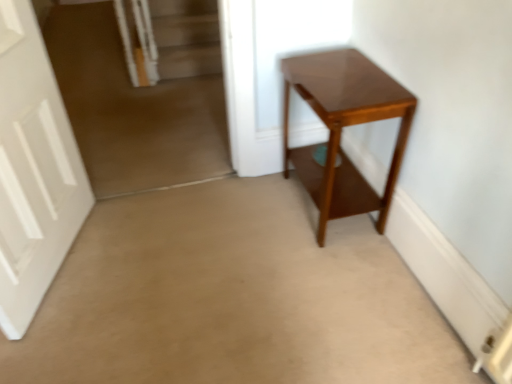
What are the coordinates of `glossy wood table at center` in the screenshot? It's located at (342, 127).

Image resolution: width=512 pixels, height=384 pixels. What do you see at coordinates (342, 127) in the screenshot?
I see `glossy wood table at center` at bounding box center [342, 127].

Describe the element at coordinates (33, 170) in the screenshot. The image size is (512, 384). I see `white matte door at left` at that location.

The image size is (512, 384). Find the location of `white matte door at left`. white matte door at left is located at coordinates (33, 170).

At what (x,y) coordinates should I click in order to perform the action: click on glossy wood table at center. Please return your answer as a coordinate pair (x, y). Looking at the image, I should click on (342, 127).

In the scene shown: Considering the positions of objects glossy wood table at center and white matte door at left in the image provided, who is more to the right, glossy wood table at center or white matte door at left?

Positioned to the right is glossy wood table at center.

Which is behind, glossy wood table at center or white matte door at left?

glossy wood table at center is further from the camera.

Between point (341, 62) and point (32, 107), which one is positioned behind?

Positioned behind is point (341, 62).

From the image's perspective, which one is positioned higher, glossy wood table at center or white matte door at left?

glossy wood table at center, from the image's perspective.

From a real-world perspective, between glossy wood table at center and white matte door at left, who is vertically lower?

glossy wood table at center.

Considering the sizes of objects glossy wood table at center and white matte door at left in the image provided, who is wider, glossy wood table at center or white matte door at left?

glossy wood table at center is wider.

Can you confirm if glossy wood table at center is shorter than white matte door at left?

Yes, glossy wood table at center is shorter than white matte door at left.

Is glossy wood table at center smaller than white matte door at left?

Actually, glossy wood table at center might be larger than white matte door at left.

Do you think glossy wood table at center is within white matte door at left, or outside of it?

glossy wood table at center is outside white matte door at left.

Would you say glossy wood table at center is a long distance from white matte door at left?

Indeed, glossy wood table at center is not near white matte door at left.

Could you tell me if glossy wood table at center is facing white matte door at left?

Yes, glossy wood table at center is facing white matte door at left.

How different are the orientations of glossy wood table at center and white matte door at left in degrees?

161 degrees separate the facing orientations of glossy wood table at center and white matte door at left.

How distant is glossy wood table at center from white matte door at left?

→ They are 1.16 meters apart.

At what (x,y) coordinates should I click in order to perform the action: click on door that appears in front of the glossy wood table at center. Please return your answer as a coordinate pair (x, y). Looking at the image, I should click on (33, 170).

Which object is positioned more to the left, white matte door at left or glossy wood table at center?

Positioned to the left is white matte door at left.

Relative to glossy wood table at center, is white matte door at left in front or behind?

white matte door at left is in front of glossy wood table at center.

Looking at this image, which is less distant, (73, 161) or (333, 196)?

Point (73, 161) is positioned farther from the camera compared to point (333, 196).

From the image's perspective, which is above, white matte door at left or glossy wood table at center?

glossy wood table at center, from the image's perspective.

From a real-world perspective, between white matte door at left and glossy wood table at center, who is vertically lower?

glossy wood table at center.

Considering the sizes of objects white matte door at left and glossy wood table at center in the image provided, who is wider, white matte door at left or glossy wood table at center?

glossy wood table at center is wider.

Who is shorter, white matte door at left or glossy wood table at center?

Result: Standing shorter between the two is glossy wood table at center.

Which of these two, white matte door at left or glossy wood table at center, is smaller?

white matte door at left.

Is white matte door at left not inside glossy wood table at center?

Absolutely, white matte door at left is external to glossy wood table at center.

Can you see white matte door at left touching glossy wood table at center?

No, white matte door at left is not beside glossy wood table at center.

Based on the photo, could you tell me if white matte door at left is turned towards glossy wood table at center?

Yes, white matte door at left is aimed at glossy wood table at center.

Locate an element on the screen. Image resolution: width=512 pixels, height=384 pixels. door positioned vertically above the glossy wood table at center (from a real-world perspective) is located at coordinates (33, 170).

Where is `table above the white matte door at left (from the image's perspective)`? table above the white matte door at left (from the image's perspective) is located at coordinates (342, 127).

Identify the location of door that appears on the left of glossy wood table at center. This screenshot has height=384, width=512. (33, 170).